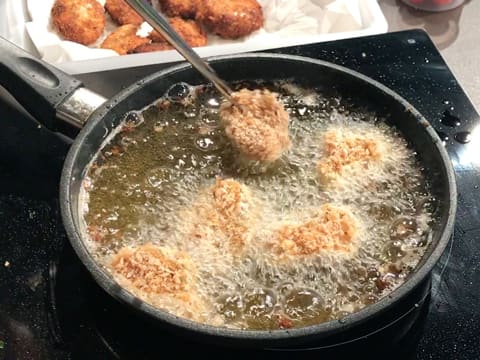
Image resolution: width=480 pixels, height=360 pixels. Find the location of `skillet handle`. skillet handle is located at coordinates (49, 85).